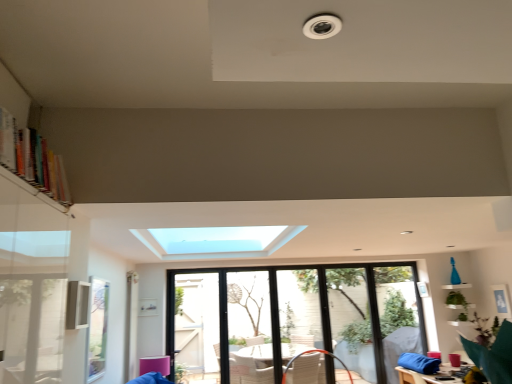
Question: From their relative heights in the image, would you say transparent glass screen door at center, which appears as the 2th screen door when viewed from the left, is taller or shorter than clear glass window at center?

Choices:
 (A) tall
 (B) short

Answer: (A)

Question: From a real-world perspective, relative to clear glass window at center, is transparent glass screen door at center, which appears as the 2th screen door when viewed from the left, vertically above or below?

Choices:
 (A) below
 (B) above

Answer: (B)

Question: Which is nearer to the multicolored wooden bookshelf at upper left?

Choices:
 (A) transparent glass screen door at center, the first screen door in the left-to-right sequence
 (B) transparent glass screen door at center, which is the 1th screen door in right-to-left order
 (C) clear glass window at center
 (D) clear glass window screen at lower left

Answer: (D)

Question: Based on their relative distances, which object is farther from the clear glass window screen at lower left?

Choices:
 (A) transparent glass screen door at center, which is the 1th screen door in right-to-left order
 (B) transparent glass screen door at center, the first screen door in the left-to-right sequence
 (C) multicolored wooden bookshelf at upper left
 (D) clear glass window at center

Answer: (D)